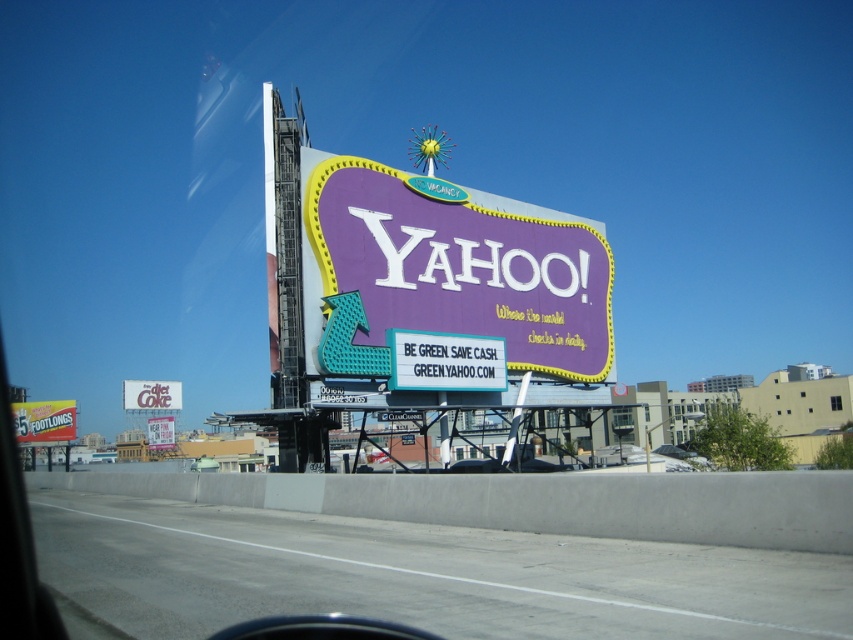
Which is more to the right, purple glossy billboard at center or white plastic signboard at center?

Positioned to the right is purple glossy billboard at center.

Is point (374, 241) farther from viewer compared to point (402, 333)?

Yes, it is.

At what (x,y) coordinates should I click in order to perform the action: click on purple glossy billboard at center. Please return your answer as a coordinate pair (x, y). Looking at the image, I should click on (462, 266).

Locate an element on the screen. purple glossy billboard at center is located at coordinates (462, 266).

Is point (241, 525) in front of point (129, 404)?

That is True.

Which is more to the right, concrete at center or white paper diet coke at upper center?

Positioned to the right is concrete at center.

Between point (480, 548) and point (138, 408), which one is positioned in front?

Point (480, 548)

Find the location of a particular element. concrete at center is located at coordinates (419, 576).

Can you confirm if purple glossy billboard at center is positioned above purple glossy billboard at upper center?

Indeed, purple glossy billboard at center is positioned over purple glossy billboard at upper center.

Can you confirm if purple glossy billboard at center is positioned below purple glossy billboard at upper center?

Incorrect, purple glossy billboard at center is not positioned below purple glossy billboard at upper center.

What are the coordinates of `purple glossy billboard at center` in the screenshot? It's located at (462, 266).